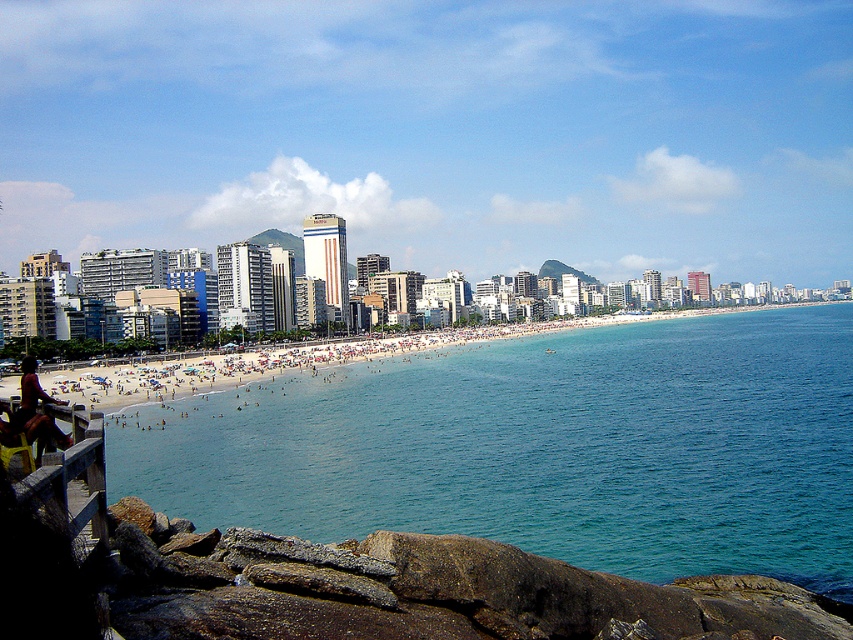
You are a photographer standing at the wooden rail at lower left and want to take a photo of the camera that is 45.01 meters away. Considering the distance, will you be able to capture the camera in your shot without moving from your current position?

The wooden rail at lower left and camera are 45.01 meters apart from each other. Since the camera is positioned 45.01 meters away from your current position at the wooden rail at lower left, you can capture the camera in your shot without needing to move, as modern cameras typically have sufficient zoom capabilities to focus on subjects at that distance.

You are standing at the wooden rail at lower left and want to walk to the beach sand at center. Which direction should you move to reach it?

The beach sand at center is to the right of the wooden rail at lower left, so you should move to your right to reach it.